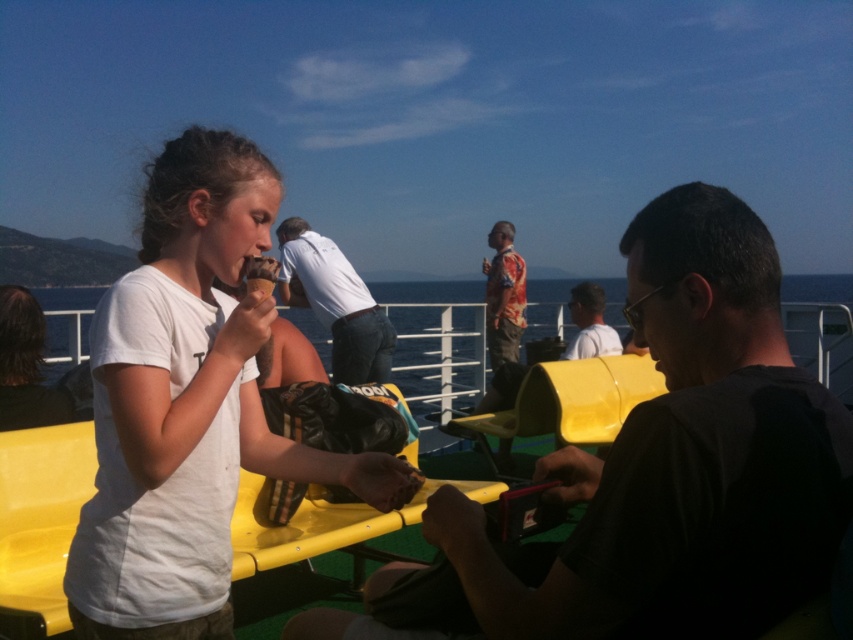
You are standing at point (579, 352) and want to move to point (328, 262). Is the path directly in front of you?

Yes, the path directly in front of you leads to point (328, 262) because it is in front of your current position at point (579, 352).

You are a passenger on the ferry and need to find a place to sit. You see the yellow plastic boat at center and the light brown leather jacket at center. Which object is closer to you?

The yellow plastic boat at center is positioned over the light brown leather jacket at center, meaning it is closer to you.

You are planning to place a light brown leather jacket at center on the deck of a yellow plastic boat at center. Based on the scene description, will the jacket fit comfortably on the boat without overcrowding it?

The yellow plastic boat at center is larger in size than the light brown leather jacket at center, so the jacket will fit comfortably on the boat without overcrowding it.